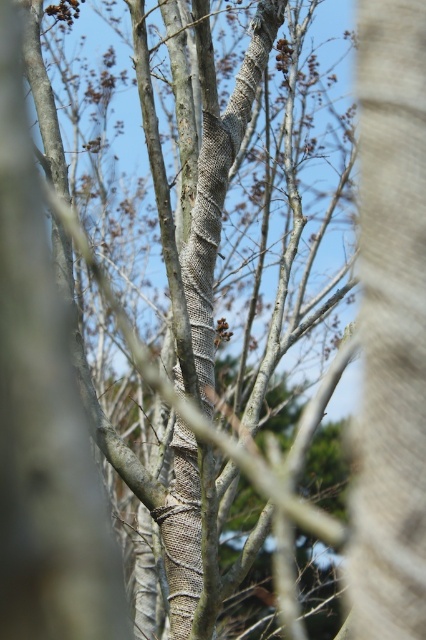
Question: Does smooth bark tree trunk at center appear on the left side of burlap-like textured tree trunk at center?

Choices:
 (A) yes
 (B) no

Answer: (B)

Question: Is smooth bark tree trunk at center below burlap-like textured tree trunk at center?

Choices:
 (A) yes
 (B) no

Answer: (A)

Question: Is smooth bark tree trunk at center smaller than burlap-like textured tree trunk at center?

Choices:
 (A) no
 (B) yes

Answer: (B)

Question: Among these points, which one is nearest to the camera?

Choices:
 (A) (423, 321)
 (B) (210, 131)

Answer: (A)

Question: Which point appears closest to the camera in this image?

Choices:
 (A) (394, 333)
 (B) (207, 172)

Answer: (A)